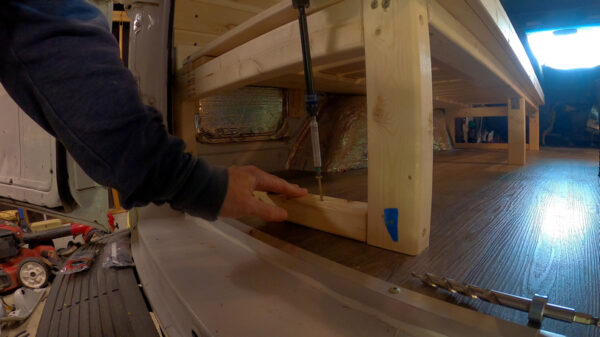
You are a GUI agent. You are given a task and a screenshot of the screen. Output one action in this format:
    pyautogui.click(x=<x>, y=<y>)
    Task: Click on the mat
    
    Given the screenshot: What is the action you would take?
    pyautogui.click(x=72, y=317)